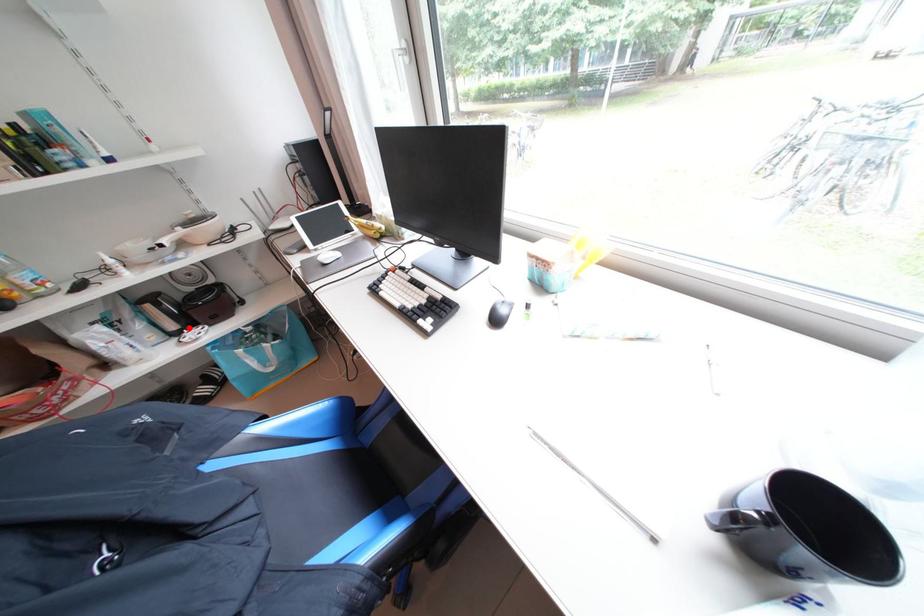
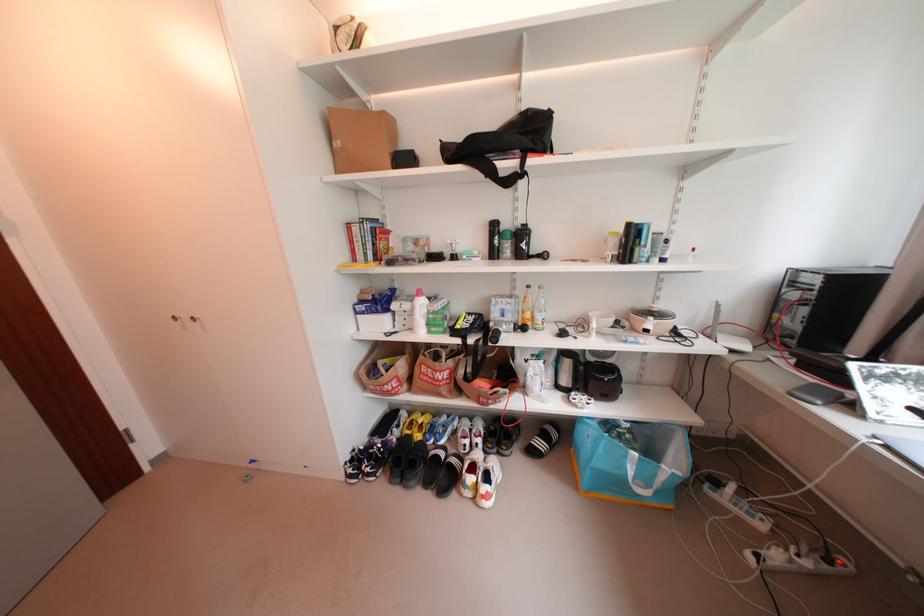
The point at the highlighted location is marked in the first image. Where is the corresponding point in the second image?

(578, 387)